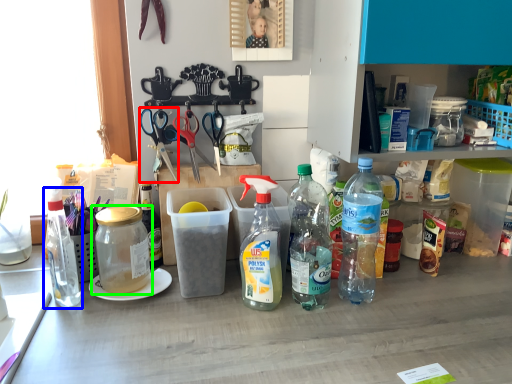
Question: Which object is the closest to the scissors (highlighted by a red box)? Choose among these: bottle (highlighted by a blue box) or bottle (highlighted by a green box).

Choices:
 (A) bottle
 (B) bottle

Answer: (B)